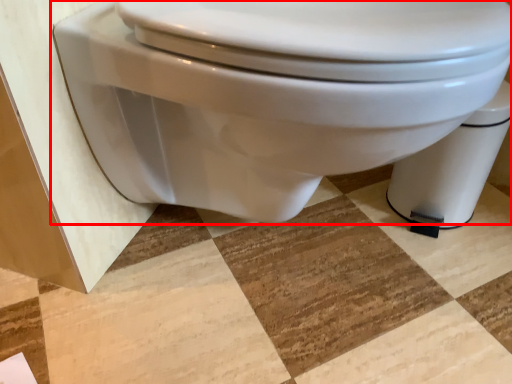
Question: From the image's perspective, what is the correct spatial relationship of toilet (annotated by the red box) in relation to toilet bowl?

Choices:
 (A) below
 (B) above

Answer: (B)